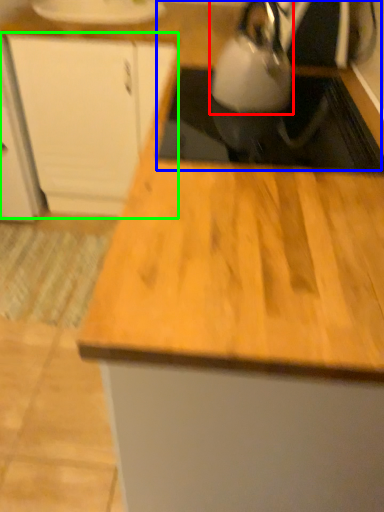
Question: Which object is the farthest from kettle (highlighted by a red box)? Choose among these: sink (highlighted by a blue box) or cabinetry (highlighted by a green box).

Choices:
 (A) sink
 (B) cabinetry

Answer: (B)